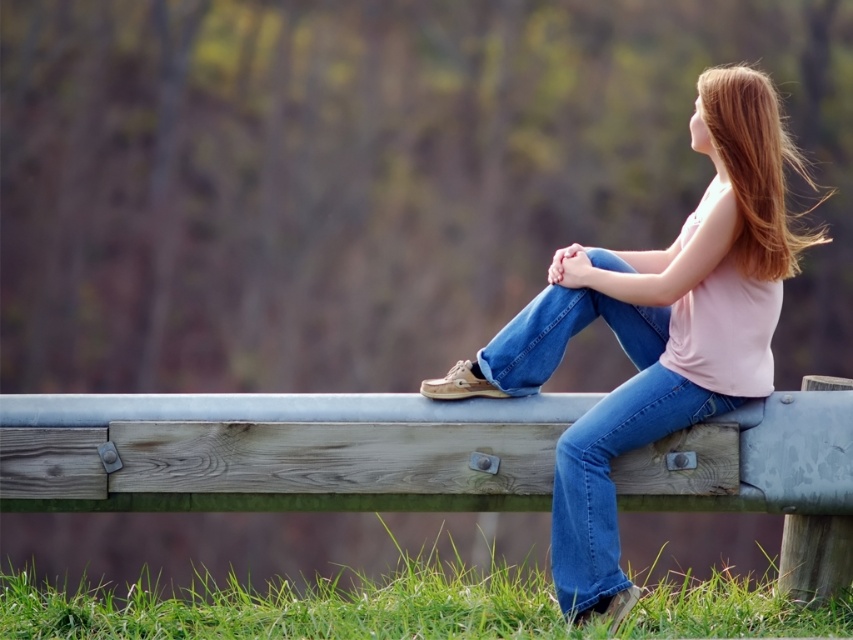
Is matte pink tank top at center to the right of shiny brown hair at upper right from the viewer's perspective?

In fact, matte pink tank top at center is to the left of shiny brown hair at upper right.

Can you confirm if matte pink tank top at center is positioned above shiny brown hair at upper right?

No.

The height and width of the screenshot is (640, 853). What do you see at coordinates (656, 330) in the screenshot?
I see `matte pink tank top at center` at bounding box center [656, 330].

Identify the location of matte pink tank top at center. (656, 330).

Is point (772, 428) farther from viewer compared to point (776, 148)?

Yes, it is.

Looking at this image, can you confirm if weathered wood rail at center is shorter than shiny brown hair at upper right?

Correct, weathered wood rail at center is not as tall as shiny brown hair at upper right.

Locate an element on the screen. This screenshot has height=640, width=853. weathered wood rail at center is located at coordinates (274, 452).

Can you confirm if weathered wood rail at center is shorter than matte pink tank top at center?

Yes.

Who is more distant from viewer, (x=218, y=422) or (x=769, y=276)?

Point (x=218, y=422)

Locate an element on the screen. The height and width of the screenshot is (640, 853). weathered wood rail at center is located at coordinates (274, 452).